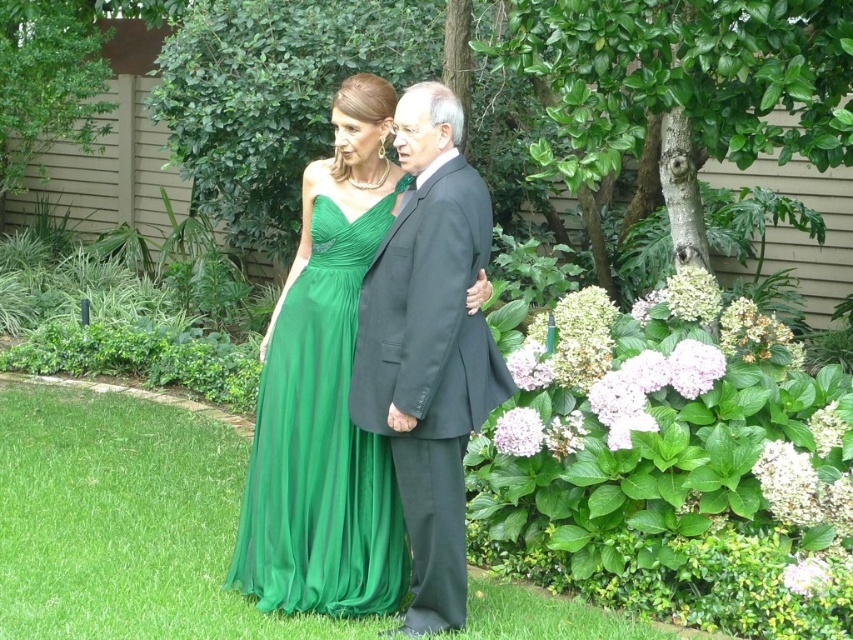
Question: Does matte black suit at center appear under emerald green chiffon dress at center?

Choices:
 (A) yes
 (B) no

Answer: (B)

Question: Can you confirm if matte black suit at center is positioned below emerald green chiffon dress at center?

Choices:
 (A) yes
 (B) no

Answer: (B)

Question: Observing the image, what is the correct spatial positioning of matte black suit at center in reference to emerald green chiffon dress at center?

Choices:
 (A) above
 (B) below

Answer: (A)